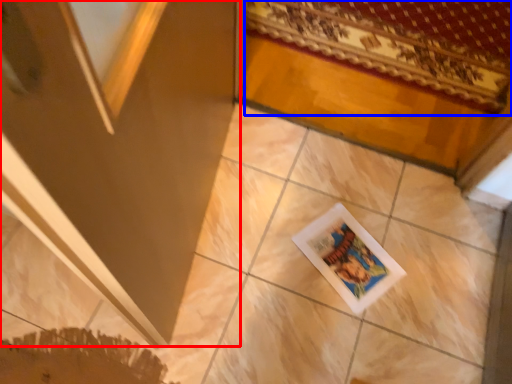
Question: Which object is further to the camera taking this photo, screen door (highlighted by a red box) or mat (highlighted by a blue box)?

Choices:
 (A) screen door
 (B) mat

Answer: (B)